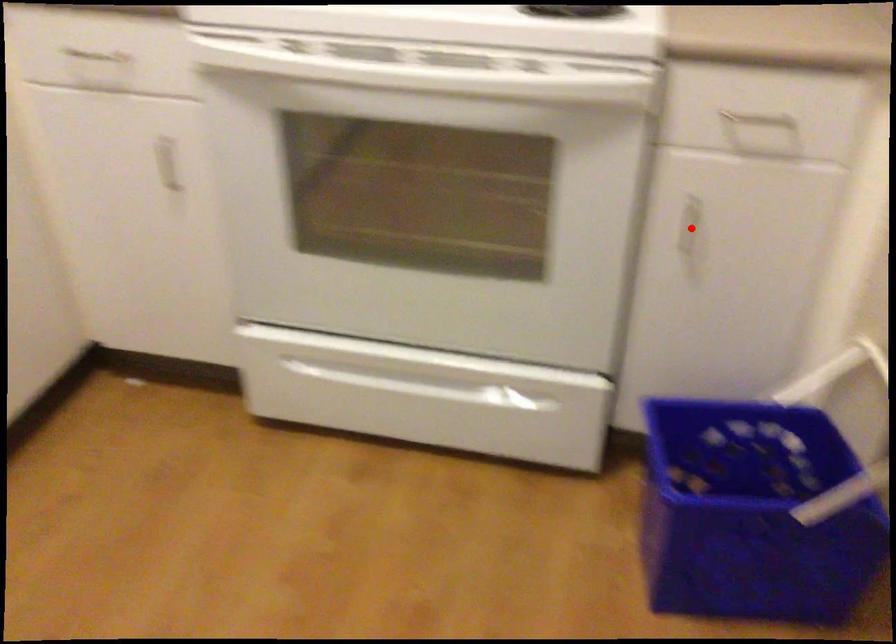
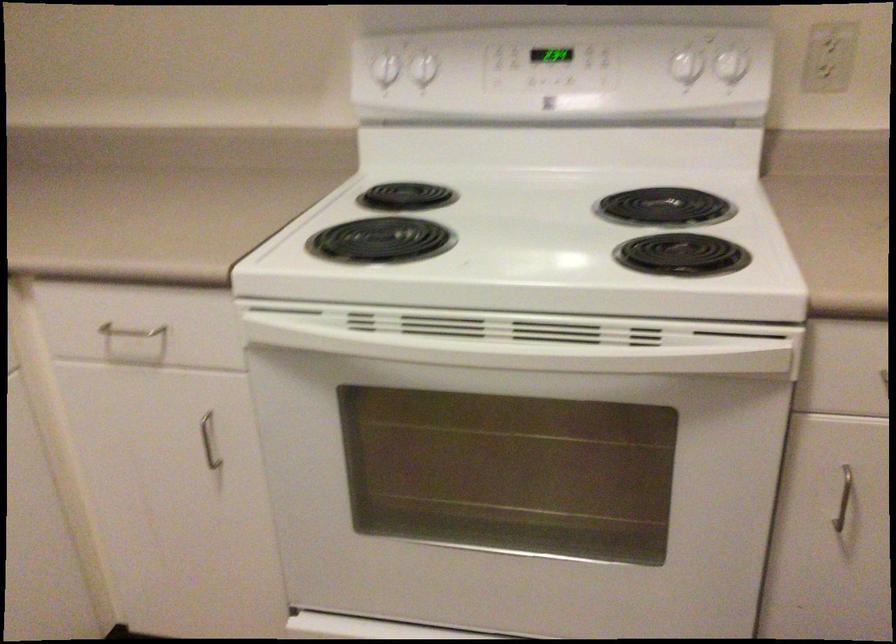
Where in the second image is the point corresponding to the highlighted location from the first image?

(842, 498)